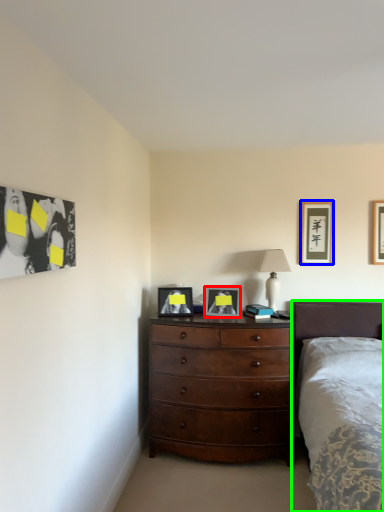
Question: Which object is the farthest from picture frame (highlighted by a red box)? Choose among these: picture frame (highlighted by a blue box) or bed (highlighted by a green box).

Choices:
 (A) picture frame
 (B) bed

Answer: (A)